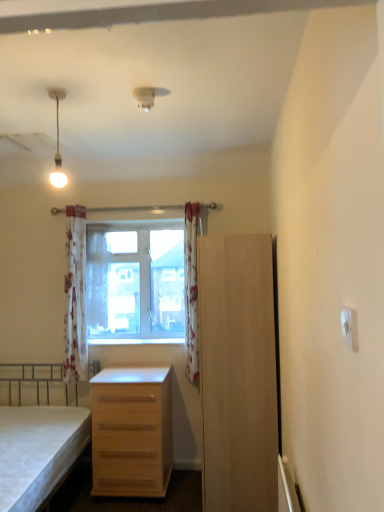
Find the location of `vacant area on top of white wood at center (from a real-world perspective)`. vacant area on top of white wood at center (from a real-world perspective) is located at coordinates (135, 342).